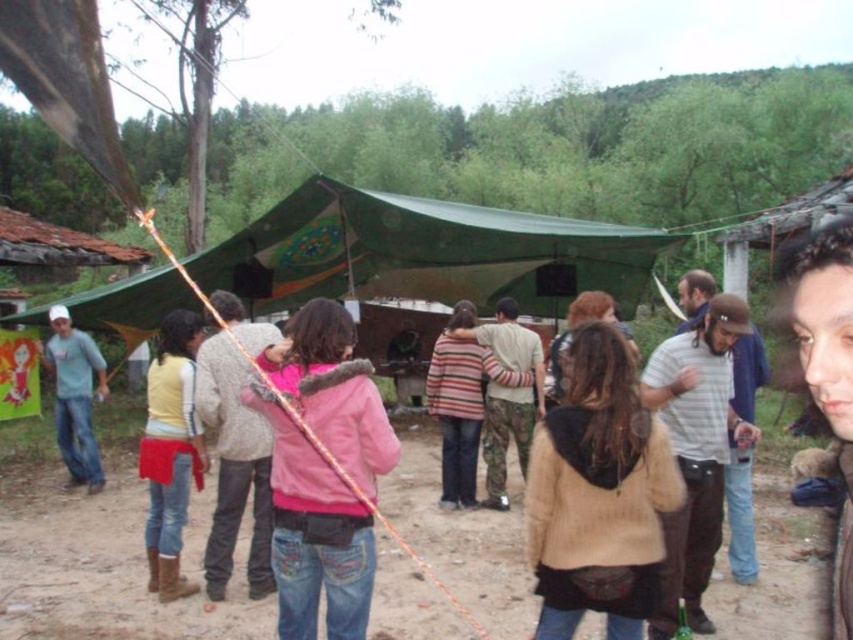
You are organizing a group photo and need to arrange two people based on their clothing. You have a person wearing a brown fuzzy coat at center and another in a matte gray shirt at left. According to the scene, which clothing item is on the right side when facing the group?

The brown fuzzy coat at center is positioned on the right side of the matte gray shirt at left, so the brown fuzzy coat at center is on the right.